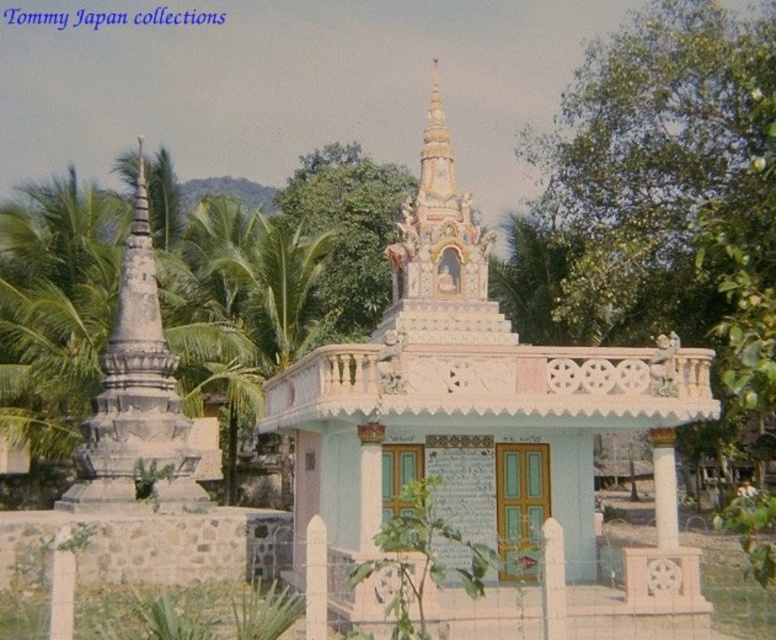
Is point (662, 294) positioned in front of point (251, 276)?

Yes.

Which of these two, green leafy tree at center or green leafy palm tree at center, stands shorter?

With less height is green leafy palm tree at center.

Who is more forward, [738,122] or [303,339]?

Point [738,122] is in front.

Identify the location of green leafy tree at center. The width and height of the screenshot is (776, 640). (671, 196).

Who is more forward, (293, 186) or (275, 240)?

Point (275, 240) is in front.

Does green leafy tree at upper center lie in front of green leafy palm tree at center?

No, green leafy tree at upper center is behind green leafy palm tree at center.

Who is more distant from viewer, (328, 308) or (293, 260)?

The point (328, 308) is behind.

Find the location of `green leafy tree at upper center`. green leafy tree at upper center is located at coordinates (347, 228).

Does green leafy tree at center have a smaller size compared to green leafy tree at upper center?

No, green leafy tree at center is not smaller than green leafy tree at upper center.

Is green leafy tree at center shorter than green leafy tree at upper center?

In fact, green leafy tree at center may be taller than green leafy tree at upper center.

Describe the element at coordinates (671, 196) in the screenshot. I see `green leafy tree at center` at that location.

This screenshot has width=776, height=640. What are the coordinates of `green leafy tree at center` in the screenshot? It's located at (671, 196).